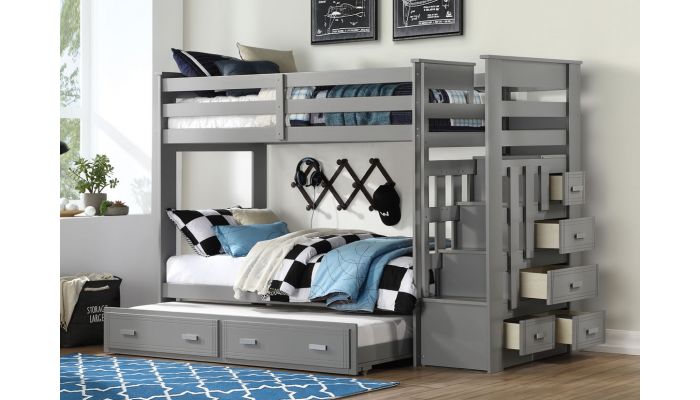
At what (x,y) coordinates should I click in order to perform the action: click on window. Please return your answer as a coordinate pair (x, y). Looking at the image, I should click on (68, 71).